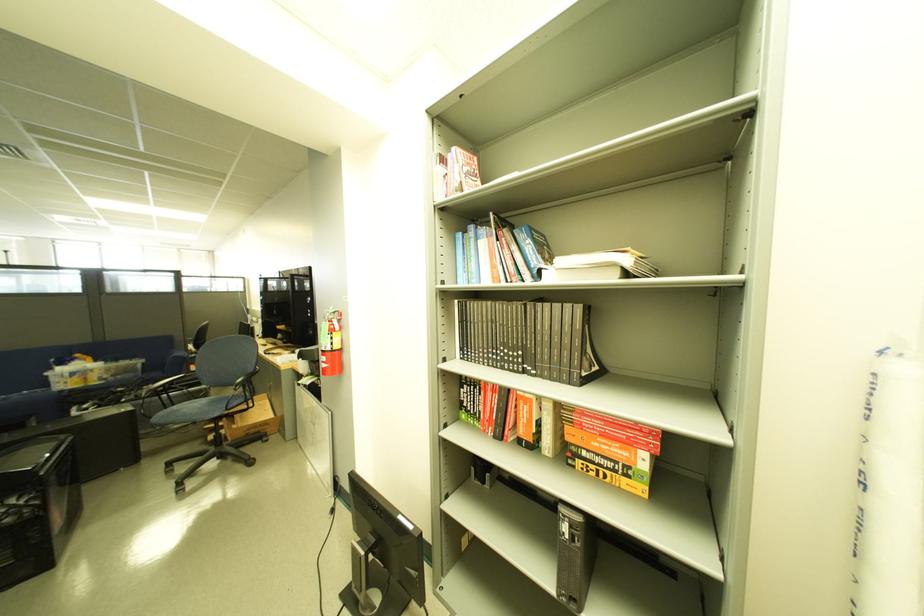
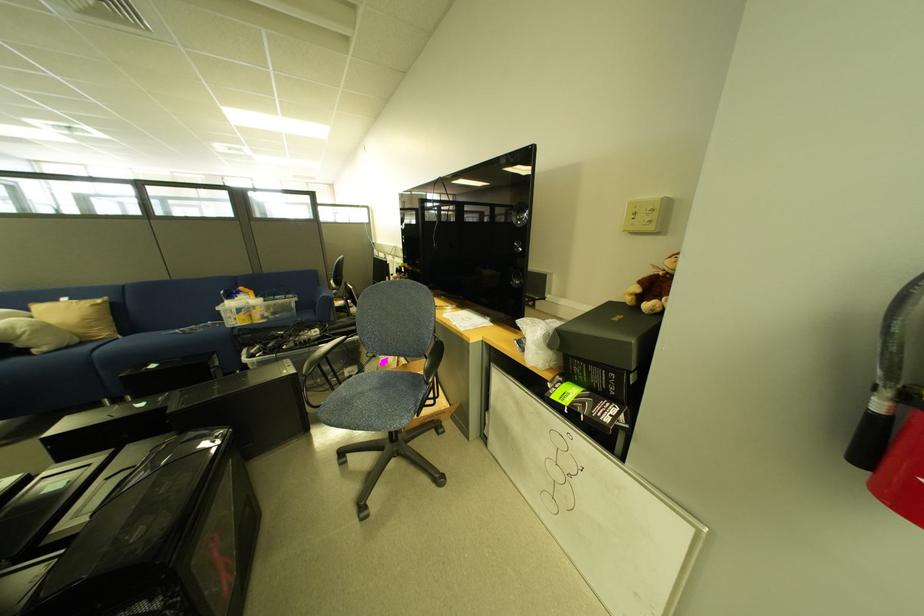
Locate, in the second image, the point that corresponds to (185,408) in the first image.

(350, 386)